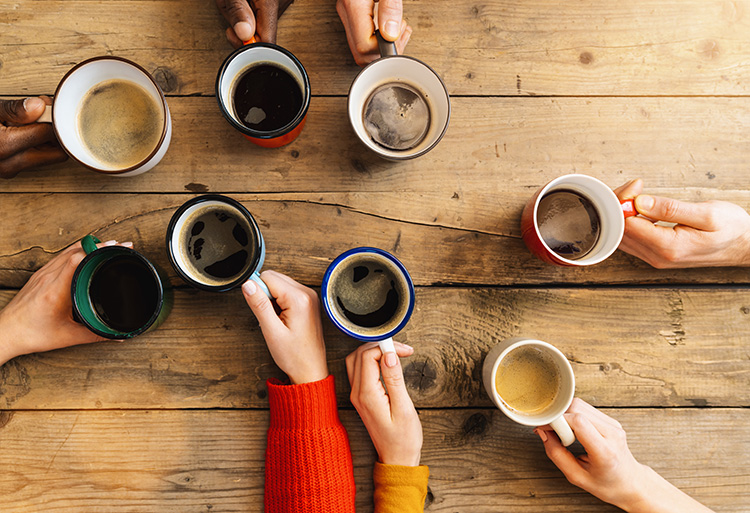
Locate an element on the screen. This screenshot has width=750, height=513. liquid in mug is located at coordinates (572, 220), (402, 103), (261, 89), (112, 101), (118, 288), (224, 240), (381, 283), (528, 372).